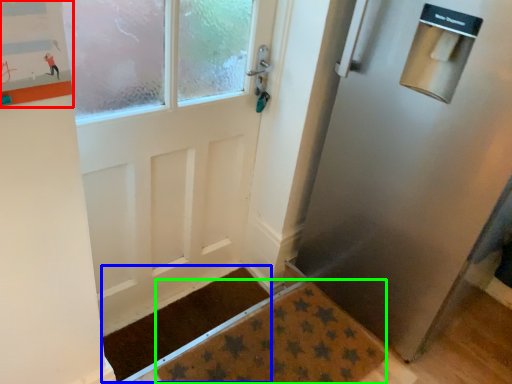
Question: Estimate the real-world distances between objects in this image. Which object is closer to bulletin board (highlighted by a red box), doormat (highlighted by a blue box) or doormat (highlighted by a green box)?

Choices:
 (A) doormat
 (B) doormat

Answer: (B)